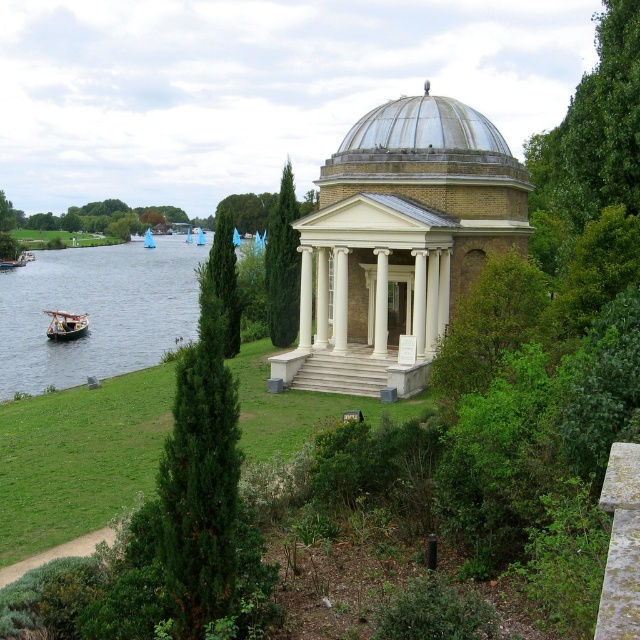
Who is higher up, green leafy tree at center or blue plastic sailboat at left?

blue plastic sailboat at left

In the scene shown: Does green leafy tree at center have a greater width compared to blue plastic sailboat at left?

Indeed, green leafy tree at center has a greater width compared to blue plastic sailboat at left.

This screenshot has width=640, height=640. What are the coordinates of `green leafy tree at center` in the screenshot? It's located at (225, 278).

Identify the location of green leafy tree at center. (225, 278).

Can you confirm if white stone gazebo at center is positioned to the left of green leafy tree at center?

In fact, white stone gazebo at center is to the right of green leafy tree at center.

Image resolution: width=640 pixels, height=640 pixels. What do you see at coordinates (397, 241) in the screenshot? I see `white stone gazebo at center` at bounding box center [397, 241].

Is point (369, 113) in front of point (225, 300)?

No, it is not.

Where is `white stone gazebo at center`? white stone gazebo at center is located at coordinates (397, 241).

What do you see at coordinates (397, 241) in the screenshot?
I see `white stone gazebo at center` at bounding box center [397, 241].

Can you confirm if white stone gazebo at center is bigger than green textured tree at center?

Yes.

You are a GUI agent. You are given a task and a screenshot of the screen. Output one action in this format:
    pyautogui.click(x=<x>, y=<y>)
    Task: Click on the white stone gazebo at center
    Image resolution: width=640 pixels, height=640 pixels.
    Given the screenshot: What is the action you would take?
    pyautogui.click(x=397, y=241)

Where is `white stone gazebo at center`? The image size is (640, 640). white stone gazebo at center is located at coordinates (397, 241).